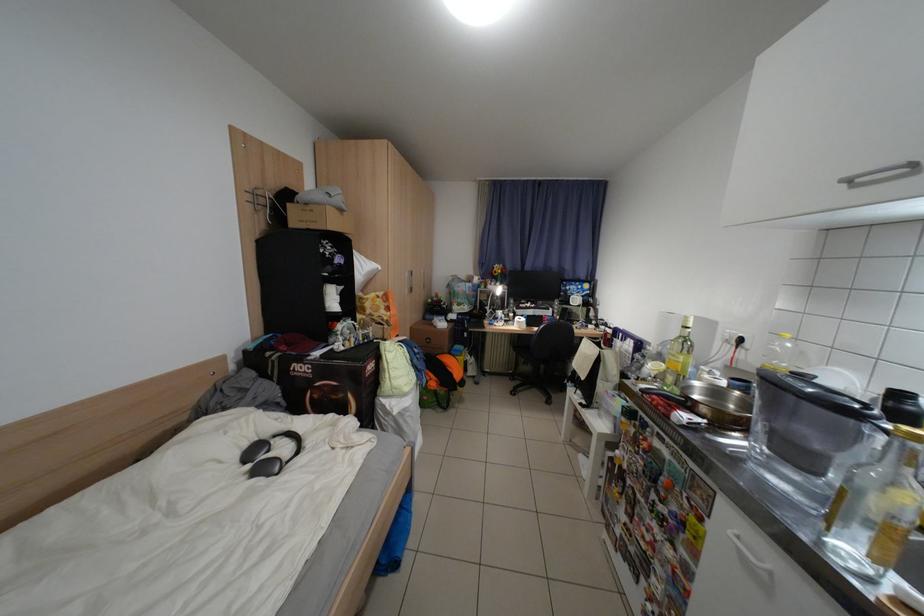
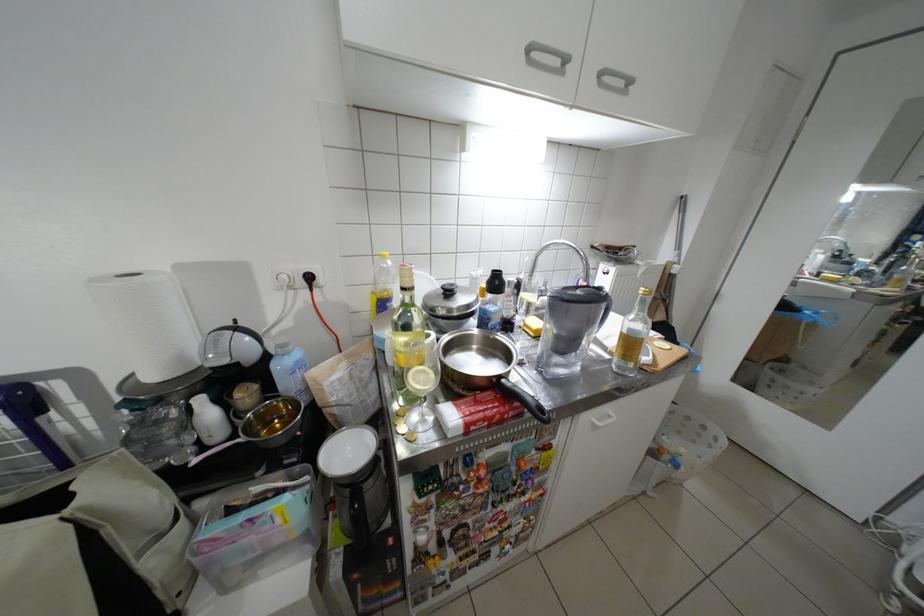
In the second image, find the point that corresponds to the point at 746,342 in the first image.

(312, 285)